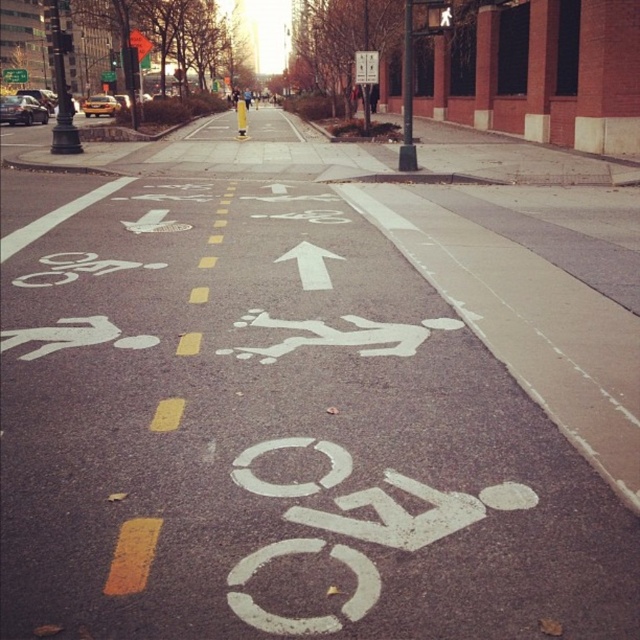
You are a cyclist planning to ride through the city street shown. The bike lane is marked with white arrows and symbols. Where exactly is the white painted bike lane at center located in terms of coordinates?

The white painted bike lane at center is located at coordinates point (273, 435).

You are a cyclist approaching the intersection and see the metallic rectangular sign at upper center and the yellow plastic traffic sign at upper center. Which one is narrower?

The metallic rectangular sign at upper center is thinner than the yellow plastic traffic sign at upper center, so the metallic rectangular sign at upper center is narrower.